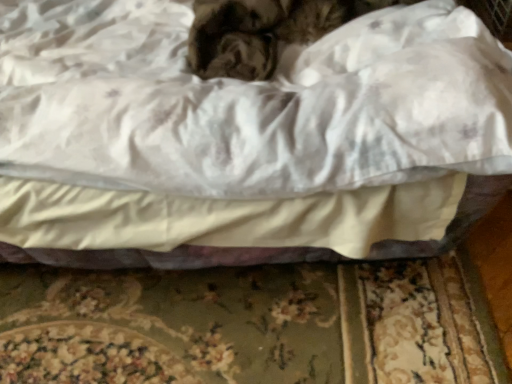
Question: Should I look upward or downward to see white satin bed at center?

Choices:
 (A) down
 (B) up

Answer: (B)